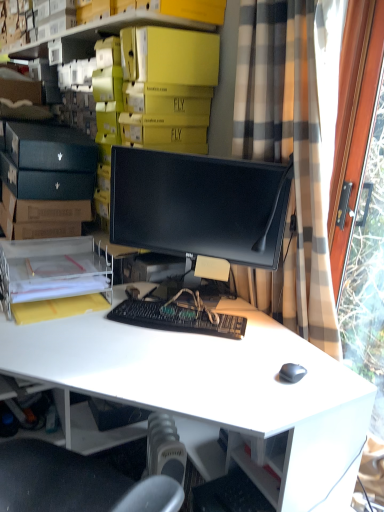
Question: Does point (236, 130) appear closer or farther from the camera than point (284, 464)?

Choices:
 (A) farther
 (B) closer

Answer: (A)

Question: Which is correct: plaid fabric curtain at right is inside white matte desk at center, or outside of it?

Choices:
 (A) outside
 (B) inside

Answer: (A)

Question: Which object is positioned closest to the white matte desk at center?

Choices:
 (A) black matte monitor at center
 (B) yellow cardboard boxes at upper center
 (C) plaid fabric curtain at right
 (D) black matte keyboard at center
 (E) clear plastic file at lower left

Answer: (D)

Question: Which is farther from the plaid fabric curtain at right?

Choices:
 (A) white matte desk at center
 (B) black matte keyboard at center
 (C) black matte monitor at center
 (D) clear plastic file at lower left
 (E) yellow cardboard boxes at upper center

Answer: (D)